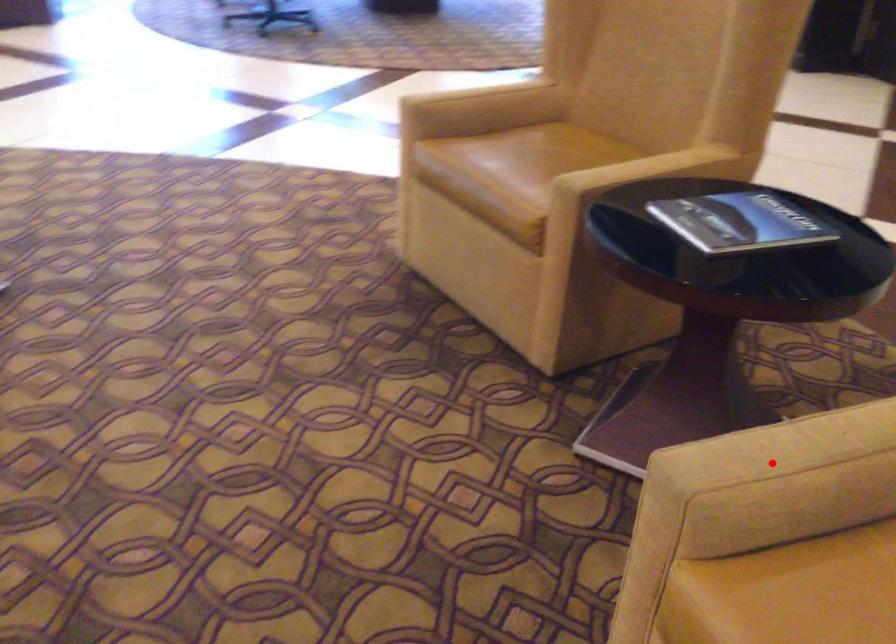
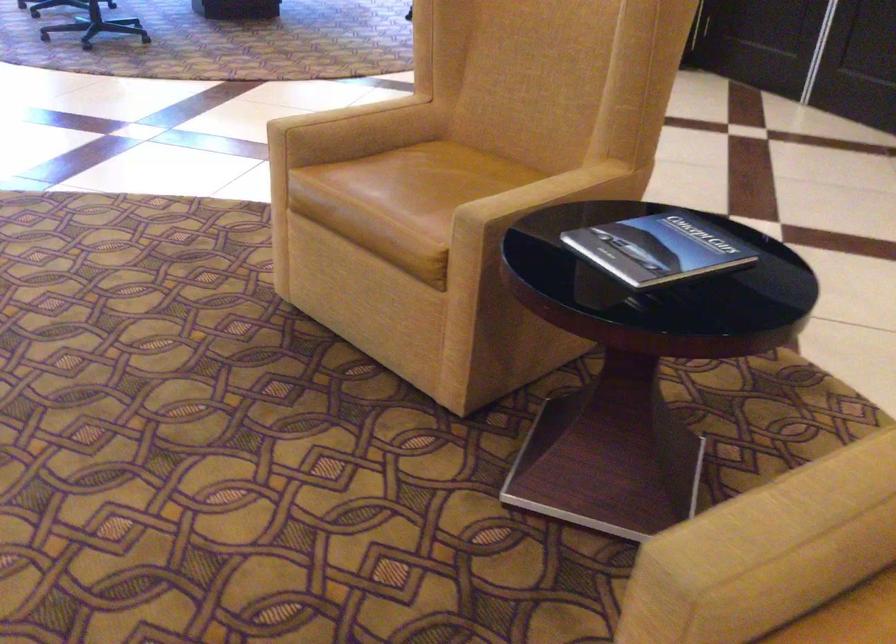
The point at the highlighted location is marked in the first image. Where is the corresponding point in the second image?

(778, 543)